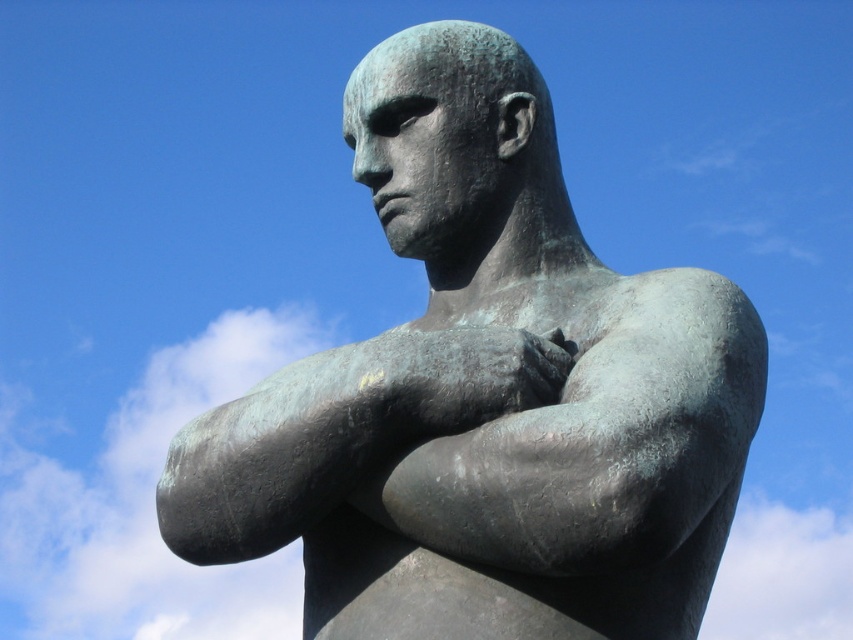
In the scene shown: You are an art restorer assessing the statue. You need to determine if the bronze textured arm at center can be fully covered by the green patina bronze statue at center when placing them side by side. Can the statue cover the arm completely?

The green patina bronze statue at center is wider than the bronze textured arm at center, so the statue can fully cover the arm when placed side by side.

Based on the photo, you are standing in front of the statue and want to take a photo of the green patina bronze statue at center. If you move 0.2 units to the right, will the statue still be in the frame?

The statue is located at point [486,396]. Moving 0.2 units to the right would shift your position, but since the statue is at the center, it should remain in the frame unless the camera angle is extremely narrow. However, without knowing the camera field of view, we can assume it would still be visible.